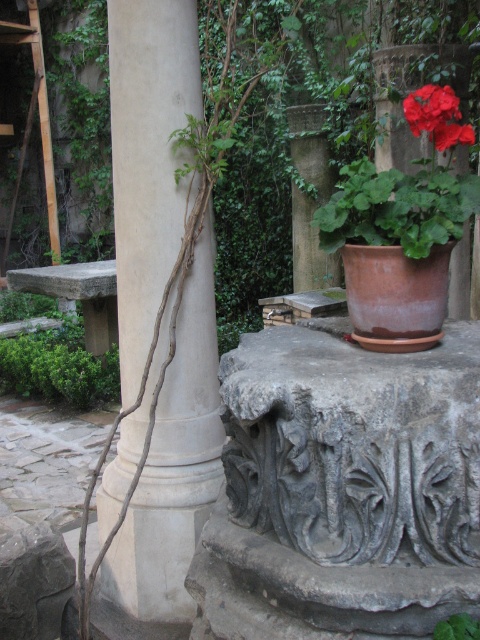
Who is lower down, white stone column at center or vivid red petals at upper right?

Positioned lower is white stone column at center.

Is point (155, 212) more distant than point (407, 102)?

Yes.

Identify the location of white stone column at center. (147, 157).

Does white stone column at center have a lesser height compared to green leafy plant at center?

No.

Can you confirm if white stone column at center is positioned above green leafy plant at center?

Yes, white stone column at center is above green leafy plant at center.

Between point (167, 301) and point (445, 620), which one is positioned behind?

The point (167, 301) is behind.

Locate an element on the screen. Image resolution: width=480 pixels, height=640 pixels. white stone column at center is located at coordinates (147, 157).

Is vivid red petals at upper right positioned behind green leafy plant at center?

Yes, it is behind green leafy plant at center.

Does point (408, 96) come in front of point (471, 618)?

That is False.

Locate an element on the screen. vivid red petals at upper right is located at coordinates (436, 116).